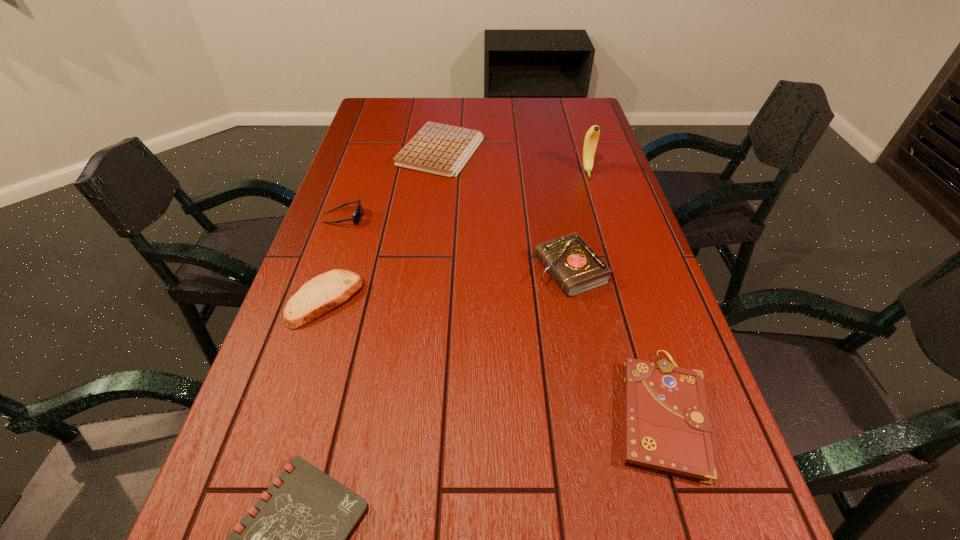
In the image, there is a desktop. Identify the location of vacant space at the far edge. (521, 112).

Where is `vacant space at the left edge of the desktop`? This screenshot has height=540, width=960. vacant space at the left edge of the desktop is located at coordinates (375, 178).

Find the location of `free space at the right edge of the desktop`. free space at the right edge of the desktop is located at coordinates (620, 227).

Locate an element on the screen. vacant space at the far right corner of the desktop is located at coordinates (590, 102).

You are a GUI agent. You are given a task and a screenshot of the screen. Output one action in this format:
    pyautogui.click(x=<x>, y=<y>)
    Task: Click on the vacant space that is in between the pita bread and the farthest notebook
    The width and height of the screenshot is (960, 540).
    Given the screenshot: What is the action you would take?
    pyautogui.click(x=383, y=226)

This screenshot has height=540, width=960. Find the location of `empty space between the banana and the second tallest object`. empty space between the banana and the second tallest object is located at coordinates [579, 221].

This screenshot has width=960, height=540. In order to click on vacant space that's between the third farthest object and the banana in this screenshot , I will do `click(466, 194)`.

Find the location of a particular element. Image resolution: width=960 pixels, height=540 pixels. empty location between the tallest object and the tallest notebook is located at coordinates [624, 292].

Locate an element on the screen. This screenshot has height=540, width=960. free area in between the pita bread and the tallest notebook is located at coordinates [493, 356].

Locate an element on the screen. free space between the second shortest object and the diary is located at coordinates (505, 211).